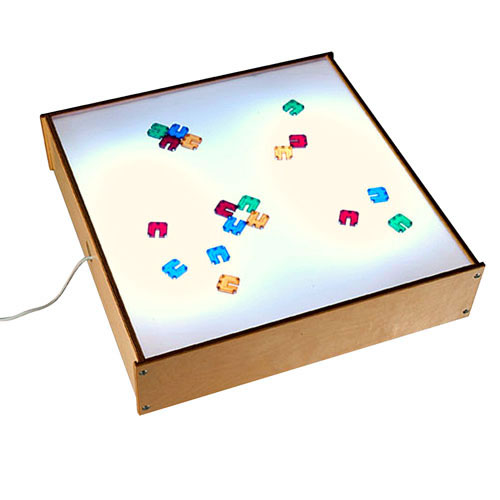
The image size is (500, 500). Find the location of `red play tile`. red play tile is located at coordinates (x=162, y=229), (x=223, y=207), (x=344, y=219), (x=298, y=140), (x=172, y=143).